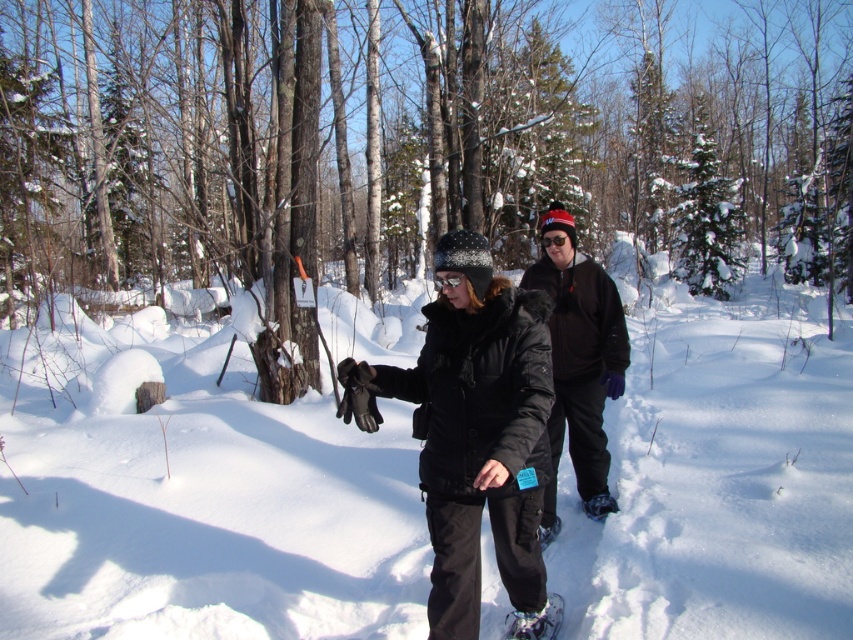
You are planning to take a winter hike and have both the black matte jacket at center and the white plastic snowshoe at lower center with you. Based on their sizes, which item would be more challenging to carry in a backpack?

The black matte jacket at center is larger in size compared to the white plastic snowshoe at lower center, so it would be more challenging to carry in a backpack.

In the winter forest scene, there is a person wearing a black fleece jacket at center and a white plastic snowshoe at lower center. Which object is located to the left of the other?

The white plastic snowshoe at lower center is to the left of the black fleece jacket at center.